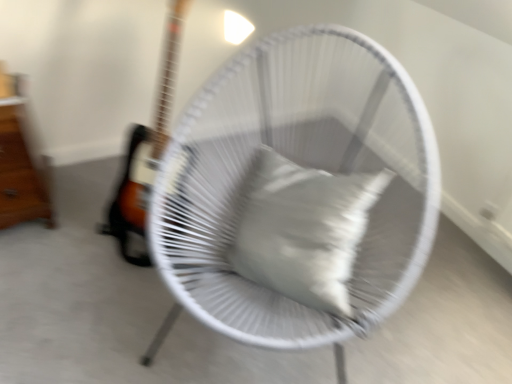
Question: Considering the relative positions of white matte pillow at center and white woven chair at center in the image provided, is white matte pillow at center behind white woven chair at center?

Choices:
 (A) yes
 (B) no

Answer: (A)

Question: Are white matte pillow at center and white woven chair at center making contact?

Choices:
 (A) no
 (B) yes

Answer: (A)

Question: From a real-world perspective, is white matte pillow at center under white woven chair at center?

Choices:
 (A) yes
 (B) no

Answer: (B)

Question: Can you confirm if white matte pillow at center is smaller than white woven chair at center?

Choices:
 (A) yes
 (B) no

Answer: (A)

Question: From the image's perspective, is white matte pillow at center below white woven chair at center?

Choices:
 (A) yes
 (B) no

Answer: (A)

Question: Can you confirm if white matte pillow at center is positioned to the right of white woven chair at center?

Choices:
 (A) no
 (B) yes

Answer: (B)

Question: Considering the relative sizes of wooden drawer at left and white matte pillow at center in the image provided, is wooden drawer at left bigger than white matte pillow at center?

Choices:
 (A) no
 (B) yes

Answer: (B)

Question: From the image's perspective, is wooden drawer at left beneath white matte pillow at center?

Choices:
 (A) no
 (B) yes

Answer: (A)

Question: Is wooden drawer at left behind white matte pillow at center?

Choices:
 (A) yes
 (B) no

Answer: (A)

Question: Is wooden drawer at left not close to white matte pillow at center?

Choices:
 (A) no
 (B) yes

Answer: (B)

Question: Does wooden drawer at left have a greater width compared to white matte pillow at center?

Choices:
 (A) no
 (B) yes

Answer: (B)

Question: Does wooden drawer at left appear on the right side of white matte pillow at center?

Choices:
 (A) yes
 (B) no

Answer: (B)

Question: Is the position of white woven chair at center less distant than that of wooden drawer at left?

Choices:
 (A) yes
 (B) no

Answer: (A)